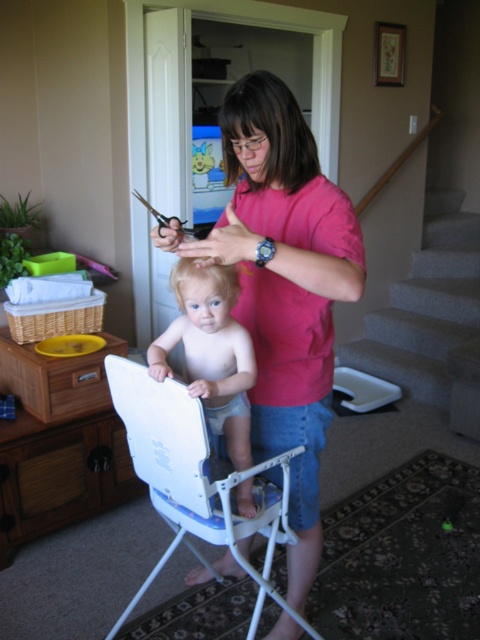
Is point (130, 426) closer to viewer compared to point (183, 268)?

No, (130, 426) is further to viewer.

Is white plastic feeding chair at center bigger than light brown plastic high chair at center?

Yes, white plastic feeding chair at center is bigger than light brown plastic high chair at center.

Where is `white plastic feeding chair at center`? The height and width of the screenshot is (640, 480). white plastic feeding chair at center is located at coordinates (194, 481).

This screenshot has width=480, height=640. Describe the element at coordinates (284, 288) in the screenshot. I see `pink fabric shirt at center` at that location.

Does point (307, 257) lie in front of point (144, 202)?

Yes, it is.

Does point (300, 486) come behind point (181, 225)?

No, it is not.

What are the coordinates of `pink fabric shirt at center` in the screenshot? It's located at (284, 288).

The width and height of the screenshot is (480, 640). What do you see at coordinates (284, 288) in the screenshot?
I see `pink fabric shirt at center` at bounding box center [284, 288].

Is point (317, 298) positioned behind point (362, 355)?

That is False.

Describe the element at coordinates (284, 288) in the screenshot. I see `pink fabric shirt at center` at that location.

In order to click on pink fabric shirt at center in this screenshot , I will do `click(284, 288)`.